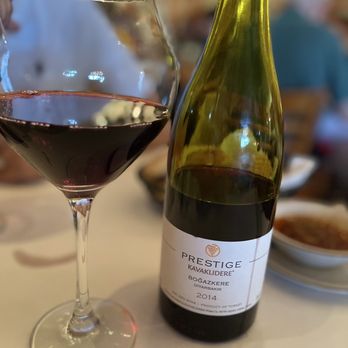
Find the location of a particular element. The width and height of the screenshot is (348, 348). wine glass is located at coordinates (100, 102).